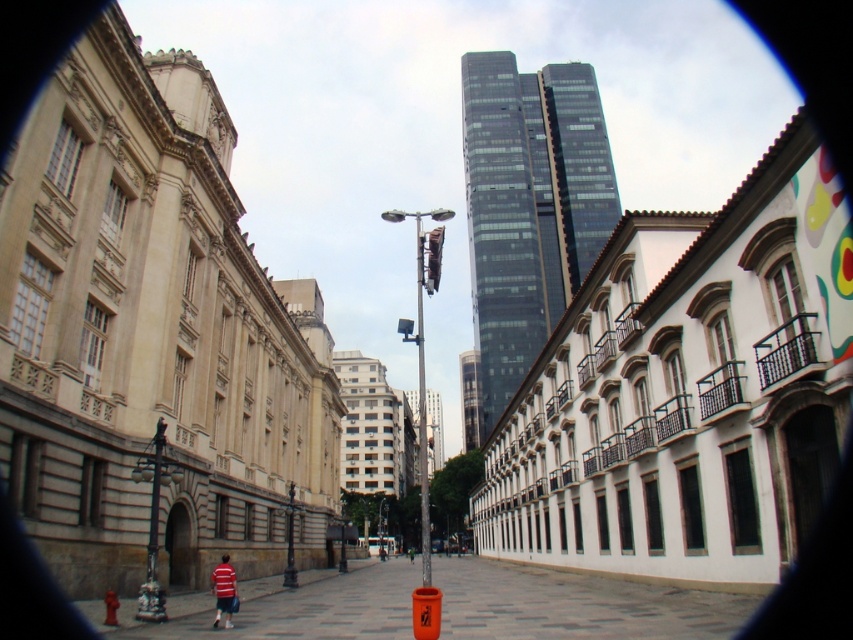
You are a delivery driver who needs to park your van on the street. The van requires a parking spot that is 3 meters long. The orange plastic traffic cone at center is placed at point 0.950, 0.130. Can you park your van between the two buildings without hitting the cone?

The orange plastic traffic cone at center is located at point (109, 608). Since the van requires a parking spot 3 meters long, you need to ensure there is enough space between the two buildings and avoid the cone. However, without knowing the exact distance between the buildings or the cone position relative to the van size, it is impossible to determine if parking is feasible.

You are a delivery person who needs to place the orange plastic traffic cone at center and the green fabric jacket at center on a shelf that can only hold items narrower than the jacket. Can both items fit?

The orange plastic traffic cone at center is wider than the green fabric jacket at center. Since the shelf can only hold items narrower than the jacket, the orange plastic traffic cone at center cannot fit, but the green fabric jacket at center can.